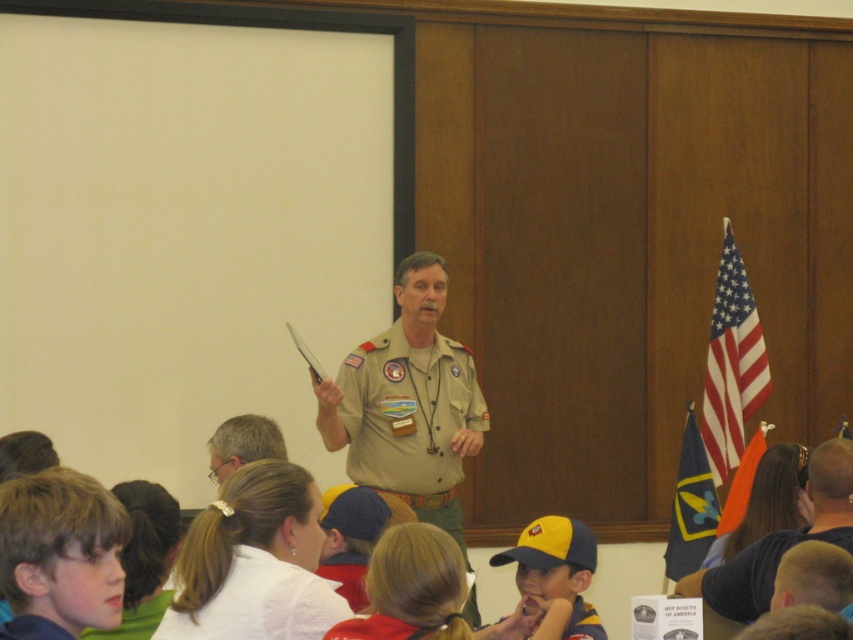
Is point (306, 509) positioned in front of point (744, 467)?

Yes, point (306, 509) is in front of point (744, 467).

Can you confirm if white silky hair at center is wider than orange fabric flag at right?

In fact, white silky hair at center might be narrower than orange fabric flag at right.

Which is behind, point (309, 508) or point (762, 432)?

The point (762, 432) is more distant.

In order to click on white silky hair at center in this screenshot , I will do `click(254, 563)`.

Which is more to the left, blue fabric flag at right or orange fabric flag at right?

From the viewer's perspective, blue fabric flag at right appears more on the left side.

Who is more forward, (700, 477) or (747, 461)?

Point (747, 461)

Where is `blue fabric flag at right`? This screenshot has width=853, height=640. blue fabric flag at right is located at coordinates (691, 506).

Which is behind, point (747, 586) or point (763, 442)?

Point (763, 442)

Between yellow fabric cap at lower right and orange fabric flag at right, which one appears on the left side from the viewer's perspective?

yellow fabric cap at lower right

Who is more forward, (740, 564) or (757, 452)?

Point (740, 564)

The height and width of the screenshot is (640, 853). Identify the location of yellow fabric cap at lower right. (758, 572).